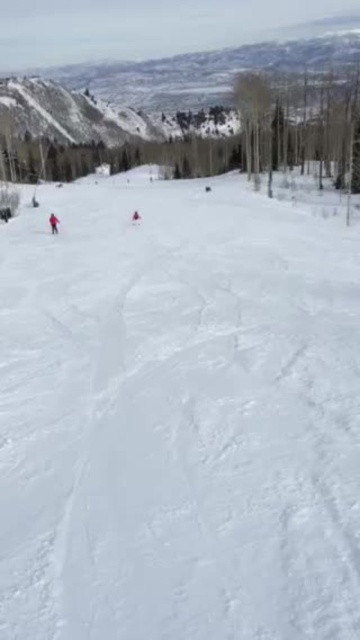
Which is behind, point (300, 396) or point (54, 218)?

The point (54, 218) is behind.

Between white powdery snow at center and matte red snowsuit at left, which one has less height?

→ Standing shorter between the two is matte red snowsuit at left.

Is point (83, 508) behind point (56, 220)?

No, (83, 508) is in front of (56, 220).

The height and width of the screenshot is (640, 360). In order to click on white powdery snow at center in this screenshot , I will do `click(178, 413)`.